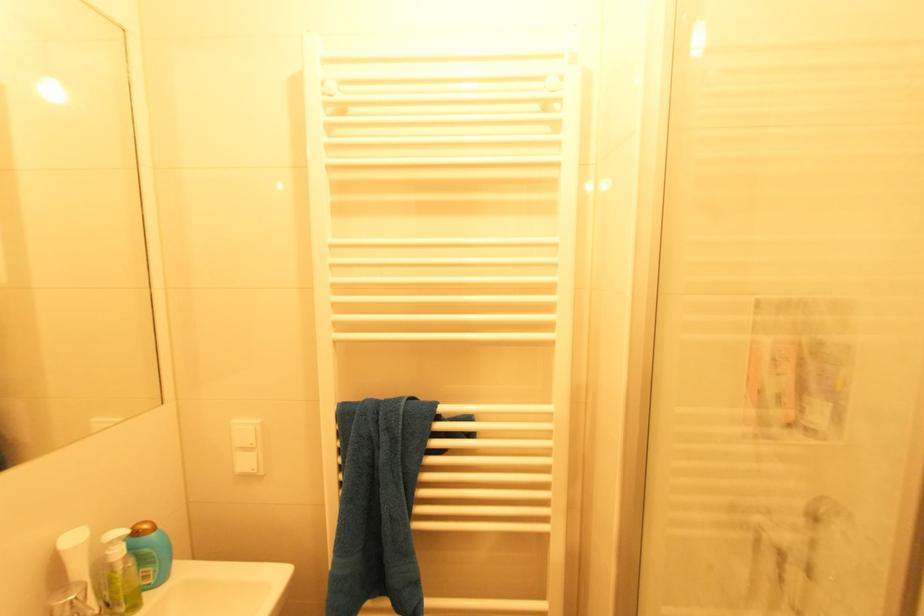
This screenshot has width=924, height=616. What do you see at coordinates (553, 82) in the screenshot? I see `the white radiator knob` at bounding box center [553, 82].